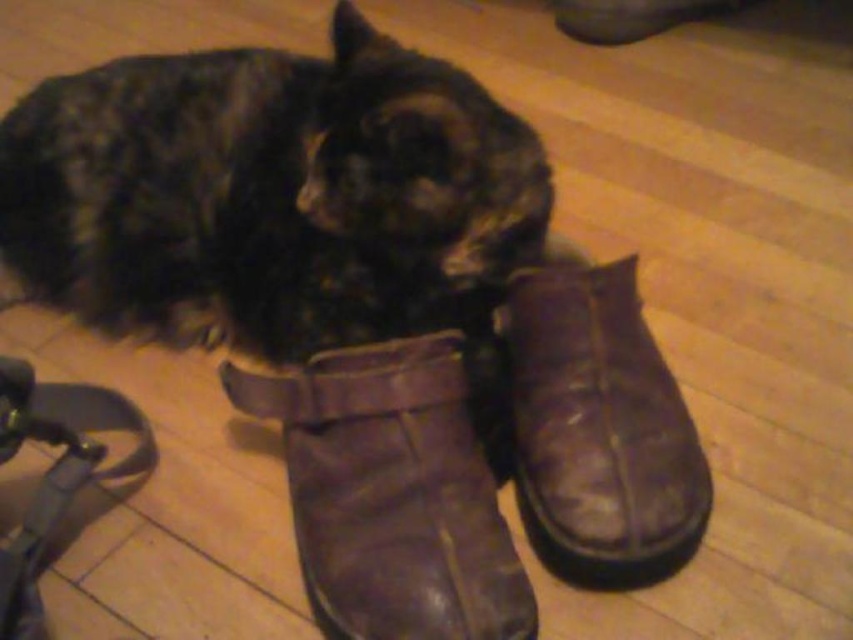
Is point (527, 630) closer to viewer compared to point (520, 448)?

Yes, it is in front of point (520, 448).

Which is behind, point (425, 497) or point (624, 458)?

Point (624, 458)

Is point (305, 468) positioned after point (624, 552)?

Yes, point (305, 468) is behind point (624, 552).

Where is `leather boot at center`? The width and height of the screenshot is (853, 640). leather boot at center is located at coordinates (392, 493).

Is the position of dark brown fur cat at center less distant than that of leather boot at lower center?

Yes, dark brown fur cat at center is closer to the viewer.

Is point (299, 115) closer to camera compared to point (618, 316)?

No.

Where is `dark brown fur cat at center`? This screenshot has width=853, height=640. dark brown fur cat at center is located at coordinates click(271, 193).

Is dark brown fur cat at center thinner than leather boot at center?

No.

The image size is (853, 640). Describe the element at coordinates (271, 193) in the screenshot. I see `dark brown fur cat at center` at that location.

Locate an element on the screen. The image size is (853, 640). dark brown fur cat at center is located at coordinates (271, 193).